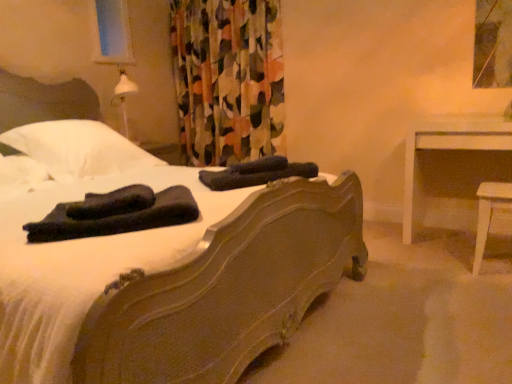
Question: Considering the positions of dark blue fabric at center, acting as the second material starting from the front, and brown wooden bed at center in the image, is dark blue fabric at center, acting as the second material starting from the front, bigger or smaller than brown wooden bed at center?

Choices:
 (A) big
 (B) small

Answer: (B)

Question: Looking at their shapes, would you say dark blue fabric at center, the second material positioned from the left, is wider or thinner than brown wooden bed at center?

Choices:
 (A) thin
 (B) wide

Answer: (A)

Question: Which object is positioned farthest from the dark blue fabric at center, marked as the first material in a right-to-left arrangement?

Choices:
 (A) white glossy table at right
 (B) floral fabric curtain at upper center
 (C) brown wooden bed at center
 (D) black fabric at bed, acting as the first material starting from the bottom
 (E) white glossy table at right

Answer: (B)

Question: Which object is positioned closest to the floral fabric curtain at upper center?

Choices:
 (A) black fabric at bed, acting as the second material starting from the top
 (B) dark blue fabric at center, acting as the second material starting from the front
 (C) brown wooden bed at center
 (D) white glossy table at right
 (E) white soft pillow at left

Answer: (E)